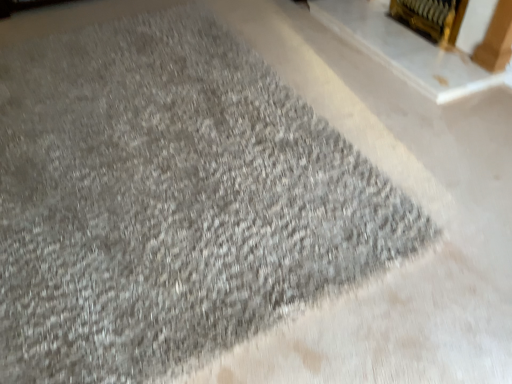
Measure the distance between point (461, 89) and camera.

Point (461, 89) is 2.06 meters from camera.

What do you see at coordinates (404, 49) in the screenshot?
I see `gold metallic fireplace at upper right, which appears as the first fireplace when viewed from the left` at bounding box center [404, 49].

Where is `gold metallic fireplace at upper right, which appears as the first fireplace when viewed from the left`? The height and width of the screenshot is (384, 512). gold metallic fireplace at upper right, which appears as the first fireplace when viewed from the left is located at coordinates (404, 49).

This screenshot has width=512, height=384. Describe the element at coordinates (432, 17) in the screenshot. I see `gold metallic fireplace at upper right, acting as the first fireplace starting from the right` at that location.

Where is `gold metallic fireplace at upper right, which is the 2th fireplace in left-to-right order`? gold metallic fireplace at upper right, which is the 2th fireplace in left-to-right order is located at coordinates (432, 17).

How much space does gold metallic fireplace at upper right, acting as the first fireplace starting from the right, occupy vertically?

gold metallic fireplace at upper right, acting as the first fireplace starting from the right, is 10.39 inches tall.

Find the location of a particular element. The image size is (512, 384). gold metallic fireplace at upper right, positioned as the second fireplace in right-to-left order is located at coordinates tap(404, 49).

Which object is positioned more to the right, gold metallic fireplace at upper right, which appears as the first fireplace when viewed from the left, or gold metallic fireplace at upper right, acting as the first fireplace starting from the right?

gold metallic fireplace at upper right, acting as the first fireplace starting from the right.

Which object is further away from the camera, gold metallic fireplace at upper right, which appears as the first fireplace when viewed from the left, or gold metallic fireplace at upper right, acting as the first fireplace starting from the right?

gold metallic fireplace at upper right, acting as the first fireplace starting from the right.

Is point (383, 10) closer or farther from the camera than point (392, 14)?

Point (383, 10).

From the image's perspective, is gold metallic fireplace at upper right, positioned as the second fireplace in right-to-left order, located above or below gold metallic fireplace at upper right, which is the 2th fireplace in left-to-right order?

Based on their image positions, gold metallic fireplace at upper right, positioned as the second fireplace in right-to-left order, is located beneath gold metallic fireplace at upper right, which is the 2th fireplace in left-to-right order.

From a real-world perspective, which object rests below the other?

gold metallic fireplace at upper right, positioned as the second fireplace in right-to-left order, is physically lower.

Considering the sizes of objects gold metallic fireplace at upper right, which appears as the first fireplace when viewed from the left, and gold metallic fireplace at upper right, acting as the first fireplace starting from the right, in the image provided, who is wider, gold metallic fireplace at upper right, which appears as the first fireplace when viewed from the left, or gold metallic fireplace at upper right, acting as the first fireplace starting from the right,?

gold metallic fireplace at upper right, which appears as the first fireplace when viewed from the left.

Looking at this image, is gold metallic fireplace at upper right, positioned as the second fireplace in right-to-left order, taller or shorter than gold metallic fireplace at upper right, acting as the first fireplace starting from the right?

Considering their sizes, gold metallic fireplace at upper right, positioned as the second fireplace in right-to-left order, has less height than gold metallic fireplace at upper right, acting as the first fireplace starting from the right.

Considering the relative sizes of gold metallic fireplace at upper right, which appears as the first fireplace when viewed from the left, and gold metallic fireplace at upper right, which is the 2th fireplace in left-to-right order, in the image provided, is gold metallic fireplace at upper right, which appears as the first fireplace when viewed from the left, smaller than gold metallic fireplace at upper right, which is the 2th fireplace in left-to-right order,?

Yes, gold metallic fireplace at upper right, which appears as the first fireplace when viewed from the left, is smaller than gold metallic fireplace at upper right, which is the 2th fireplace in left-to-right order.

Is gold metallic fireplace at upper right, acting as the first fireplace starting from the right, completely or partially inside gold metallic fireplace at upper right, positioned as the second fireplace in right-to-left order?

No.

Can you see gold metallic fireplace at upper right, which appears as the first fireplace when viewed from the left, touching gold metallic fireplace at upper right, which is the 2th fireplace in left-to-right order?

gold metallic fireplace at upper right, which appears as the first fireplace when viewed from the left, and gold metallic fireplace at upper right, which is the 2th fireplace in left-to-right order, are not in contact.

Is gold metallic fireplace at upper right, acting as the first fireplace starting from the right, at the back of gold metallic fireplace at upper right, which appears as the first fireplace when viewed from the left?

No, gold metallic fireplace at upper right, which appears as the first fireplace when viewed from the left, is not facing away from gold metallic fireplace at upper right, acting as the first fireplace starting from the right.

Where is `fireplace below the gold metallic fireplace at upper right, which is the 2th fireplace in left-to-right order (from the image's perspective)`? This screenshot has height=384, width=512. fireplace below the gold metallic fireplace at upper right, which is the 2th fireplace in left-to-right order (from the image's perspective) is located at coordinates (404, 49).

Which object is positioned more to the right, gold metallic fireplace at upper right, which is the 2th fireplace in left-to-right order, or gold metallic fireplace at upper right, which appears as the first fireplace when viewed from the left?

gold metallic fireplace at upper right, which is the 2th fireplace in left-to-right order, is more to the right.

Which is behind, gold metallic fireplace at upper right, which is the 2th fireplace in left-to-right order, or gold metallic fireplace at upper right, which appears as the first fireplace when viewed from the left?

Positioned behind is gold metallic fireplace at upper right, which is the 2th fireplace in left-to-right order.

Is point (437, 2) positioned after point (485, 87)?

That is True.

From the image's perspective, is gold metallic fireplace at upper right, acting as the first fireplace starting from the right, located above gold metallic fireplace at upper right, which appears as the first fireplace when viewed from the left?

Correct, gold metallic fireplace at upper right, acting as the first fireplace starting from the right, appears higher than gold metallic fireplace at upper right, which appears as the first fireplace when viewed from the left, in the image.

From a real-world perspective, which is physically above, gold metallic fireplace at upper right, acting as the first fireplace starting from the right, or gold metallic fireplace at upper right, positioned as the second fireplace in right-to-left order?

From a 3D spatial view, gold metallic fireplace at upper right, acting as the first fireplace starting from the right, is above.

Which object is wider, gold metallic fireplace at upper right, which is the 2th fireplace in left-to-right order, or gold metallic fireplace at upper right, which appears as the first fireplace when viewed from the left?

gold metallic fireplace at upper right, which appears as the first fireplace when viewed from the left, is wider.

Is gold metallic fireplace at upper right, acting as the first fireplace starting from the right, taller or shorter than gold metallic fireplace at upper right, which appears as the first fireplace when viewed from the left?

gold metallic fireplace at upper right, acting as the first fireplace starting from the right, is taller than gold metallic fireplace at upper right, which appears as the first fireplace when viewed from the left.

Does gold metallic fireplace at upper right, acting as the first fireplace starting from the right, have a smaller size compared to gold metallic fireplace at upper right, positioned as the second fireplace in right-to-left order?

Actually, gold metallic fireplace at upper right, acting as the first fireplace starting from the right, might be larger than gold metallic fireplace at upper right, positioned as the second fireplace in right-to-left order.

Does gold metallic fireplace at upper right, acting as the first fireplace starting from the right, contain gold metallic fireplace at upper right, positioned as the second fireplace in right-to-left order?

No, gold metallic fireplace at upper right, positioned as the second fireplace in right-to-left order, is not a part of gold metallic fireplace at upper right, acting as the first fireplace starting from the right.

Would you say gold metallic fireplace at upper right, acting as the first fireplace starting from the right, is a long distance from gold metallic fireplace at upper right, which appears as the first fireplace when viewed from the left?

gold metallic fireplace at upper right, acting as the first fireplace starting from the right, is near gold metallic fireplace at upper right, which appears as the first fireplace when viewed from the left, not far away.

Does gold metallic fireplace at upper right, acting as the first fireplace starting from the right, turn towards gold metallic fireplace at upper right, positioned as the second fireplace in right-to-left order?

Yes, gold metallic fireplace at upper right, acting as the first fireplace starting from the right, is oriented towards gold metallic fireplace at upper right, positioned as the second fireplace in right-to-left order.

How different are the orientations of gold metallic fireplace at upper right, which is the 2th fireplace in left-to-right order, and gold metallic fireplace at upper right, positioned as the second fireplace in right-to-left order, in degrees?

0.639 degrees.

I want to click on fireplace behind the gold metallic fireplace at upper right, which appears as the first fireplace when viewed from the left, so click(432, 17).

Locate an element on the screen. The height and width of the screenshot is (384, 512). fireplace lying in front of the gold metallic fireplace at upper right, which is the 2th fireplace in left-to-right order is located at coordinates (404, 49).

This screenshot has width=512, height=384. Identify the location of fireplace located underneath the gold metallic fireplace at upper right, acting as the first fireplace starting from the right (from a real-world perspective). (404, 49).